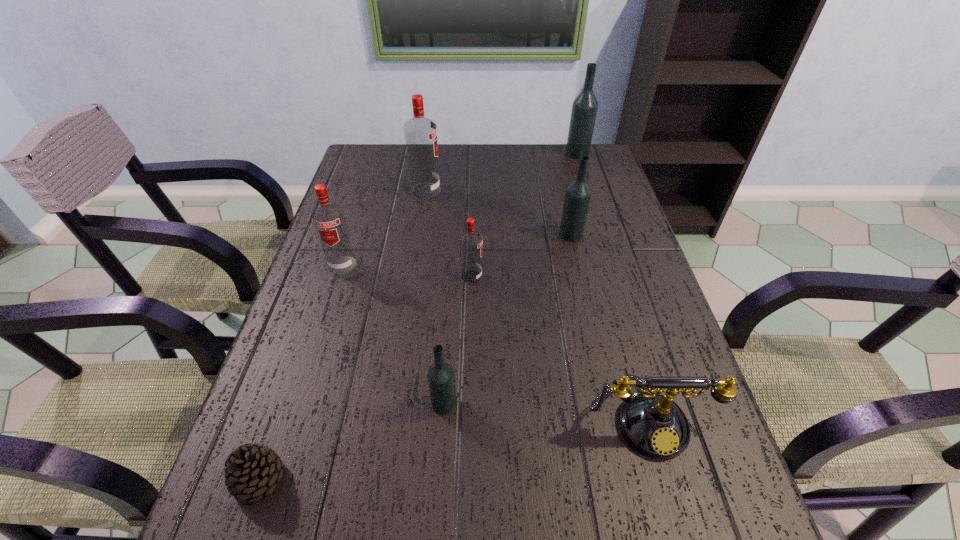
You are a GUI agent. You are given a task and a screenshot of the screen. Output one action in this format:
    pyautogui.click(x=<x>, y=<y>)
    Task: Click on the free space located at the narrow end of the pinecone
    This screenshot has width=960, height=540.
    Given the screenshot: What is the action you would take?
    pyautogui.click(x=417, y=478)

Identify the location of object that is at the far edge. (584, 109).

You are a GUI agent. You are given a task and a screenshot of the screen. Output one action in this format:
    pyautogui.click(x=<x>, y=<y>)
    Task: Click on the vodka located at the left edge
    Image resolution: width=960 pixels, height=540 pixels.
    Given the screenshot: What is the action you would take?
    click(329, 220)

Locate an element on the screen. pinecone located at the left edge is located at coordinates (252, 470).

This screenshot has width=960, height=540. Identify the location of telephone positioned at the right edge. (653, 424).

Where is `object located at the far right corner`? The height and width of the screenshot is (540, 960). object located at the far right corner is located at coordinates (584, 109).

This screenshot has width=960, height=540. What are the coordinates of `vacant position at the far edge of the desktop` in the screenshot? It's located at (469, 154).

At what (x,y) coordinates should I click in order to perform the action: click on vacant position at the left edge of the desktop. Please return your answer as a coordinate pair (x, y). Image resolution: width=960 pixels, height=540 pixels. Looking at the image, I should click on (388, 204).

Find the location of a particular element. vacant region at the right edge of the desktop is located at coordinates (624, 233).

Locate an element on the screen. The width and height of the screenshot is (960, 540). vacant space at the far left corner of the desktop is located at coordinates (352, 178).